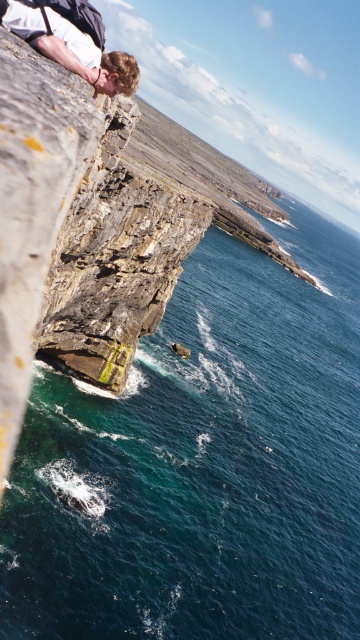
You are a hiker who wants to take a photo of the blue water at lower left and the matte white shirt at upper left. Which object should you focus on first if you want to capture both in one frame without moving your camera?

The blue water at lower left is much taller than the matte white shirt at upper left, so you should focus on the blue water at lower left first to ensure it fills the frame appropriately before adjusting for the matte white shirt at upper left.

You are a hiker who has reached the cliff edge. You see the blue water at lower left and the matte white shirt at upper left. Which object is positioned to the right of the other?

The blue water at lower left is positioned to the right of the matte white shirt at upper left.